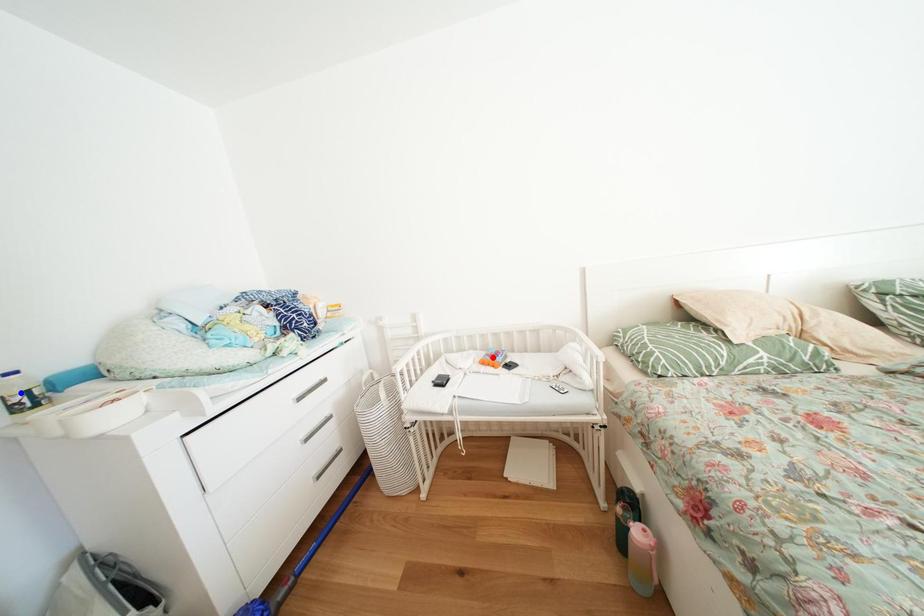
Question: Two points are marked on the image. Which point is closer to the camera?

Choices:
 (A) Blue point is closer.
 (B) Red point is closer.

Answer: (A)